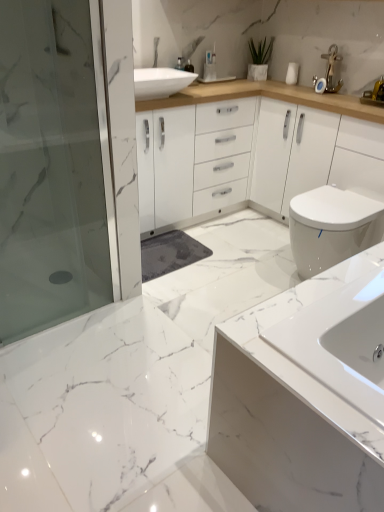
Question: From a real-world perspective, is white glossy toilet at right positioned above or below white glossy sink at lower right?

Choices:
 (A) below
 (B) above

Answer: (A)

Question: In terms of width, does white glossy toilet at right look wider or thinner when compared to white glossy sink at lower right?

Choices:
 (A) thin
 (B) wide

Answer: (B)

Question: Which is nearer to the white glossy sink at lower right?

Choices:
 (A) transparent glass shower door at left
 (B) green matte plant at upper center
 (C) white glossy toilet at right

Answer: (C)

Question: Which object is the closest to the green matte plant at upper center?

Choices:
 (A) transparent glass shower door at left
 (B) white glossy sink at lower right
 (C) white glossy toilet at right

Answer: (C)